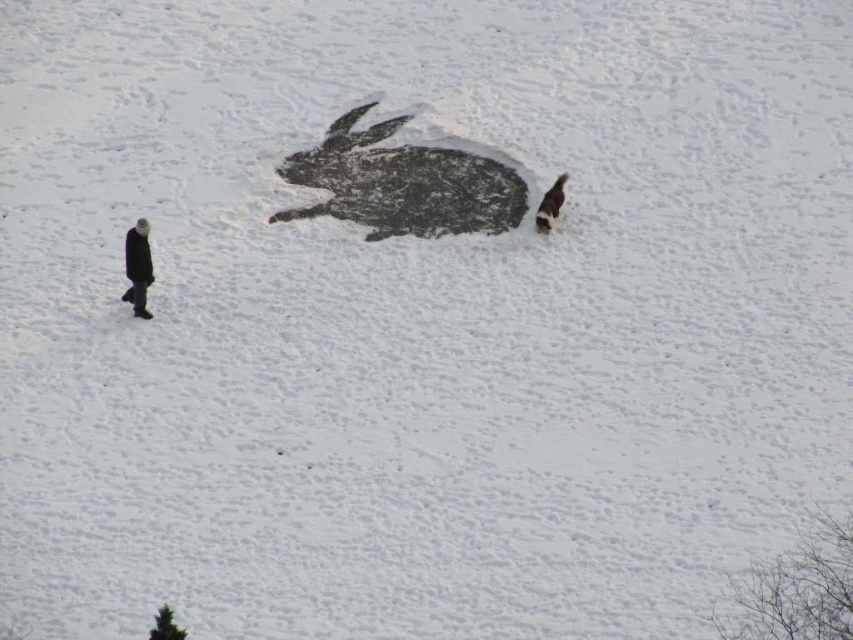
You are planning to take a photo of the dark gray wool coat at left and the fluffy white dog at right. Which one should you focus on first if you want to capture both in the same frame without moving the camera?

You should focus on the dark gray wool coat at left first because it is larger and closer to the camera, ensuring it remains in focus while adjusting for the fluffy white dog at right.

You are standing in the snowy landscape and want to take a photo of both the black textured snow rabbit at center and the fluffy white dog at right. Which object should you focus on first to ensure both are in the frame?

You should focus on the black textured snow rabbit at center first because it is closer to you than the fluffy white dog at right, so adjusting the camera to include it will also capture the dog in the background.

From the picture: You are standing in the snowy landscape and want to walk from point A to point B. Point A is at coordinates point (509, 204) and point B is at coordinates point (550, 211). Which point is closer to you, point A or point B?

Point A is closer to you because it is further to the viewer than point B.